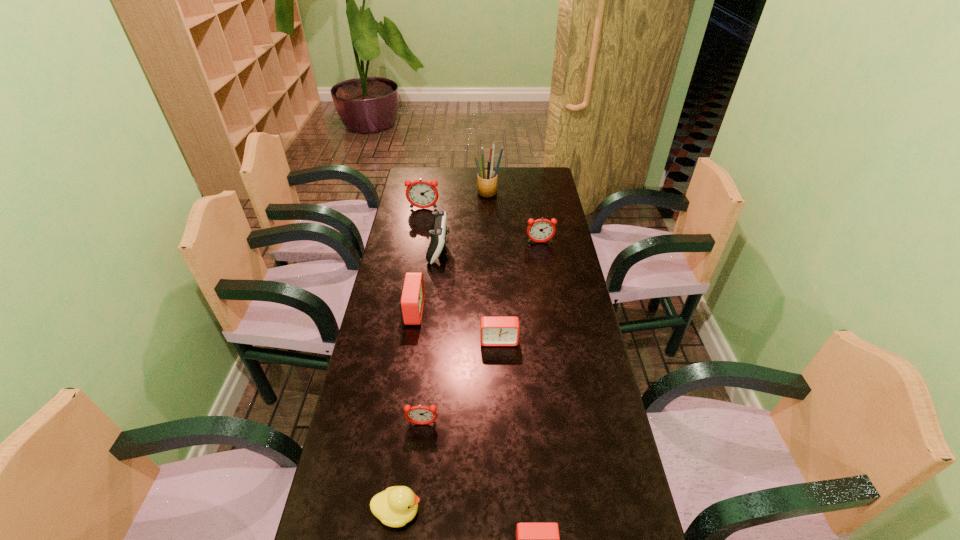
Identify the location of alarm clock that is the fifth closest to the control. This screenshot has width=960, height=540. (422, 415).

Locate which alarm clock ranks fourth in proximity to the tallest alarm clock. Please provide its 2D coordinates. Your answer should be formatted as a tuple, i.e. [(x, y)], where the tuple contains the x and y coordinates of a point satisfying the conditions above.

[(422, 415)]

Where is `the second closest reddish-pink alarm clock relative to the control`? the second closest reddish-pink alarm clock relative to the control is located at coordinates (541, 230).

Find the location of a particular element. The image size is (960, 540). reddish-pink alarm clock identified as the closest to the fourth nearest alarm clock is located at coordinates (422, 415).

Image resolution: width=960 pixels, height=540 pixels. In order to click on the closest red alarm clock relative to the fifth farthest object in this screenshot , I will do `click(494, 330)`.

Select which red alarm clock is the third closest to the duckling. Please provide its 2D coordinates. Your answer should be formatted as a tuple, i.e. [(x, y)], where the tuple contains the x and y coordinates of a point satisfying the conditions above.

[(411, 303)]